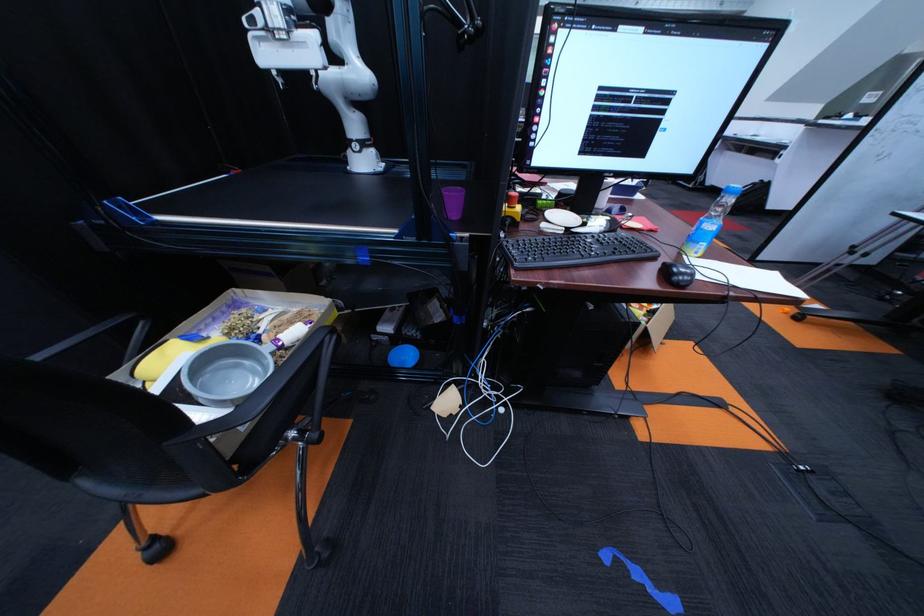
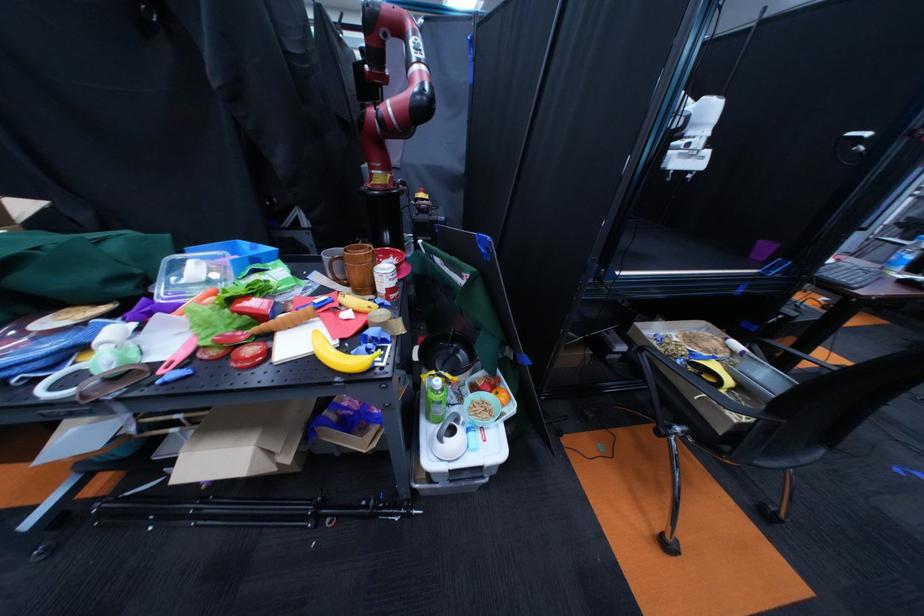
Question: I am providing you with two images of the same scene from different viewpoints. Which of the following objects are not visible in image2?

Choices:
 (A) white plastic hanger
 (B) plastic water bottle
 (C) cardboard tray
 (D) clear bottle pump

Answer: (B)